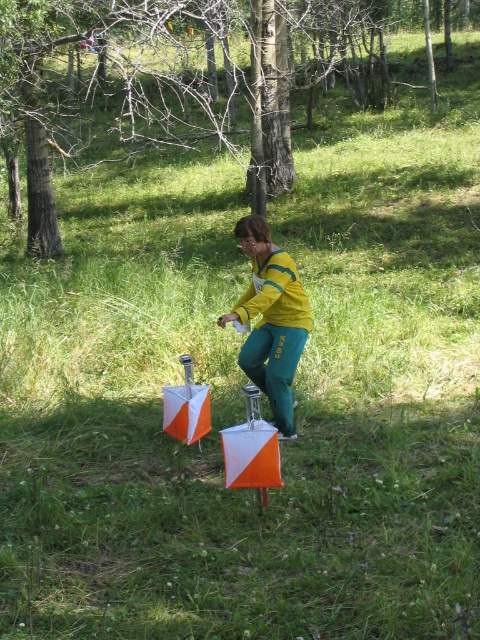
You are standing at the point marked by the orange and white triangular markers in the foreground of the image. Based on the coordinates provided, which object is located at point (113,84)?

The point (113,84) indicates the location of the brown wood tree at upper center.

You are an outdoor enthusiast planning to set up a tent in the area shown. Considering the brown wood tree at upper center and the yellow fabric pants at center, which object would cast a longer shadow at noon? Please explain your reasoning based on their positions and sizes.

The brown wood tree at upper center is much taller than the yellow fabric pants at center, so it would cast a longer shadow at noon because taller objects generally cast longer shadows when the sun is high in the sky.

You are an outdoor enthusiast planning to take a photo of the yellow fabric pants at center and the brown wood tree at upper center. Which object will appear closer to the camera in the photo?

The brown wood tree at upper center will appear closer to the camera because the yellow fabric pants at center is behind it.